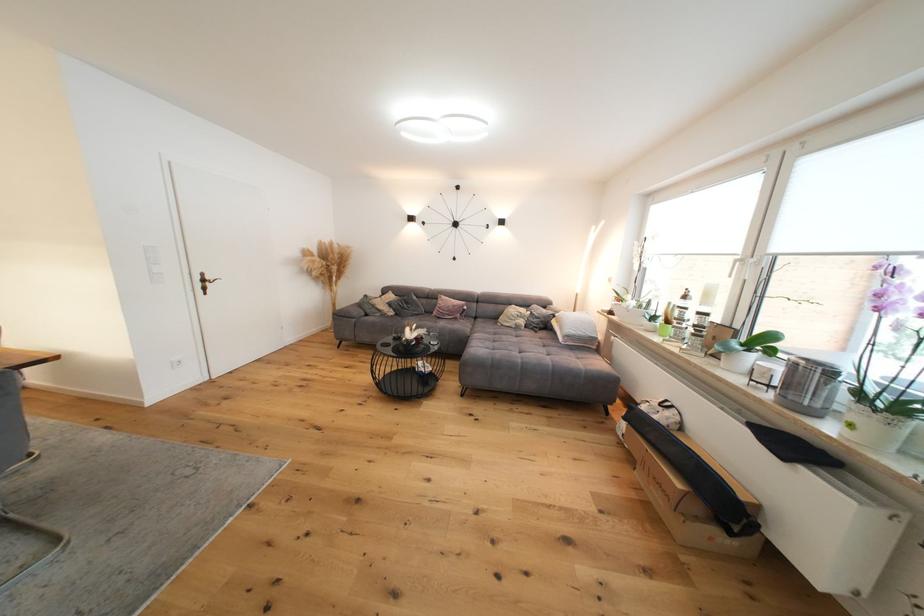
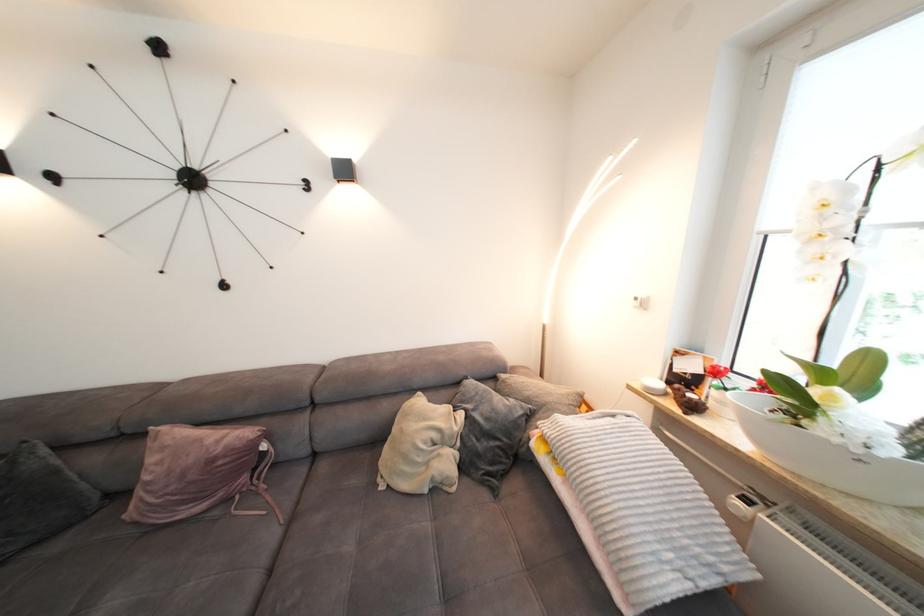
Locate, in the second image, the point that corresponds to point (528, 318) in the first image.

(450, 440)